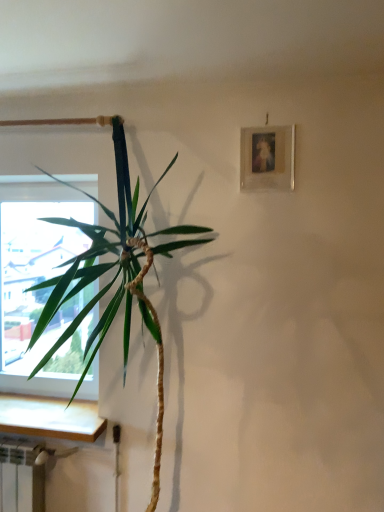
The height and width of the screenshot is (512, 384). Describe the element at coordinates (267, 158) in the screenshot. I see `wooden frame at upper right` at that location.

Find the location of a particular element. The width and height of the screenshot is (384, 512). wooden frame at upper right is located at coordinates (267, 158).

The height and width of the screenshot is (512, 384). In order to click on wooden frame at upper right in this screenshot , I will do `click(267, 158)`.